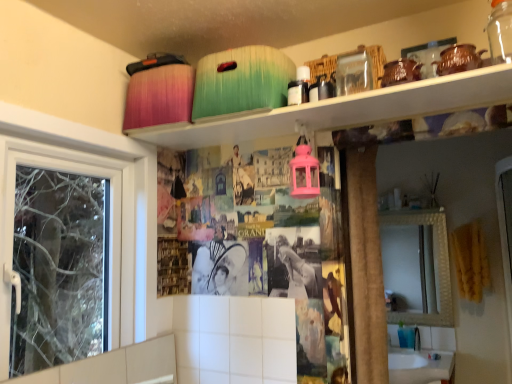
The height and width of the screenshot is (384, 512). What do you see at coordinates (353, 72) in the screenshot?
I see `transparent glass jar at upper center` at bounding box center [353, 72].

Where is `white glossy sink at lower right`? white glossy sink at lower right is located at coordinates (422, 357).

Between point (353, 88) and point (439, 344), which one is positioned behind?

Point (439, 344)

Is transparent glass jar at upper center in contact with white glossy sink at lower right?

No, transparent glass jar at upper center is not touching white glossy sink at lower right.

Can you tell me how much transparent glass jar at upper center and white glossy sink at lower right differ in facing direction?

The angular difference between transparent glass jar at upper center and white glossy sink at lower right is 2.78 degrees.

The image size is (512, 384). In order to click on sink below the transparent glass jar at upper center (from a real-world perspective) in this screenshot , I will do `click(422, 357)`.

Is point (346, 93) less distant than point (274, 136)?

That is True.

Does transparent glass jar at upper center have a lesser height compared to matte plastic containers at upper center?

Incorrect, the height of transparent glass jar at upper center does not fall short of that of matte plastic containers at upper center.

Is transparent glass jar at upper center with matte plastic containers at upper center?

transparent glass jar at upper center and matte plastic containers at upper center are clearly separated.

Is white glossy sink at lower right looking in the opposite direction of transparent glass jar at upper center?

That's not correct — white glossy sink at lower right is not looking away from transparent glass jar at upper center.

In the scene shown: Is white glossy sink at lower right next to transparent glass jar at upper center and touching it?

No, white glossy sink at lower right is not next to transparent glass jar at upper center.

Considering their positions, is white glossy sink at lower right located in front of or behind transparent glass jar at upper center?

white glossy sink at lower right is positioned farther from the viewer than transparent glass jar at upper center.

From the image's perspective, is white glossy sink at lower right above or below transparent glass jar at upper center?

Based on their image positions, white glossy sink at lower right is located beneath transparent glass jar at upper center.

Can you confirm if matte plastic containers at upper center is shorter than transparent glass jar at upper center?

Yes, matte plastic containers at upper center is shorter than transparent glass jar at upper center.

Is matte plastic containers at upper center touching transparent glass jar at upper center?

They are not placed beside each other.

From the image's perspective, is matte plastic containers at upper center on top of transparent glass jar at upper center?

Incorrect, from the image's perspective, matte plastic containers at upper center is lower than transparent glass jar at upper center.

Which is nearer, (433,78) or (362,71)?

The point (433,78) is more forward.

From a real-world perspective, is white glossy sink at lower right over matte plastic containers at upper center?

No.

Is white glossy sink at lower right aimed at matte plastic containers at upper center?

No, white glossy sink at lower right is not facing towards matte plastic containers at upper center.

Is point (422, 326) in front of point (202, 145)?

No, it is not.

Is white glossy sink at lower right in contact with matte plastic containers at upper center?

No, white glossy sink at lower right is not next to matte plastic containers at upper center.

At what (x,y) coordinates should I click in order to perform the action: click on sink on the right of the matte plastic containers at upper center. Please return your answer as a coordinate pair (x, y). The height and width of the screenshot is (384, 512). Looking at the image, I should click on (422, 357).

From a real-world perspective, which object stands above the other?

matte plastic containers at upper center.

Considering the positions of points (213, 121) and (449, 356), is point (213, 121) farther from camera compared to point (449, 356)?

No, (213, 121) is closer to viewer.

From the image's perspective, who appears lower, matte plastic containers at upper center or white glossy sink at lower right?

white glossy sink at lower right.

What are the coordinates of `sink below the transparent glass jar at upper center (from the image's perspective)` in the screenshot? It's located at (422, 357).

This screenshot has height=384, width=512. In the image, there is a transparent glass jar at upper center. Find the location of `shelf below it (from a real-world perspective)`. shelf below it (from a real-world perspective) is located at coordinates (349, 110).

Looking at the image, which one is located further to white glossy sink at lower right, transparent glass jar at upper center or matte plastic containers at upper center?

Based on the image, transparent glass jar at upper center appears to be further to white glossy sink at lower right.

Estimate the real-world distances between objects in this image. Which object is closer to transparent glass jar at upper center, matte plastic containers at upper center or white glossy sink at lower right?

Based on the image, matte plastic containers at upper center appears to be nearer to transparent glass jar at upper center.

From the image, which object appears to be farther from matte plastic containers at upper center, white glossy sink at lower right or transparent glass jar at upper center?

white glossy sink at lower right is positioned further to the anchor matte plastic containers at upper center.

Which object lies further to the anchor point white glossy sink at lower right, matte plastic containers at upper center or transparent glass jar at upper center?

transparent glass jar at upper center is positioned further to the anchor white glossy sink at lower right.

Which object lies further to the anchor point transparent glass jar at upper center, white glossy sink at lower right or matte plastic containers at upper center?

Among the two, white glossy sink at lower right is located further to transparent glass jar at upper center.

Considering their positions, is transparent glass jar at upper center positioned further to matte plastic containers at upper center than white glossy sink at lower right?

white glossy sink at lower right is positioned further to the anchor matte plastic containers at upper center.

Where is `shelf that lies between transparent glass jar at upper center and white glossy sink at lower right from top to bottom`? The width and height of the screenshot is (512, 384). shelf that lies between transparent glass jar at upper center and white glossy sink at lower right from top to bottom is located at coordinates (349, 110).